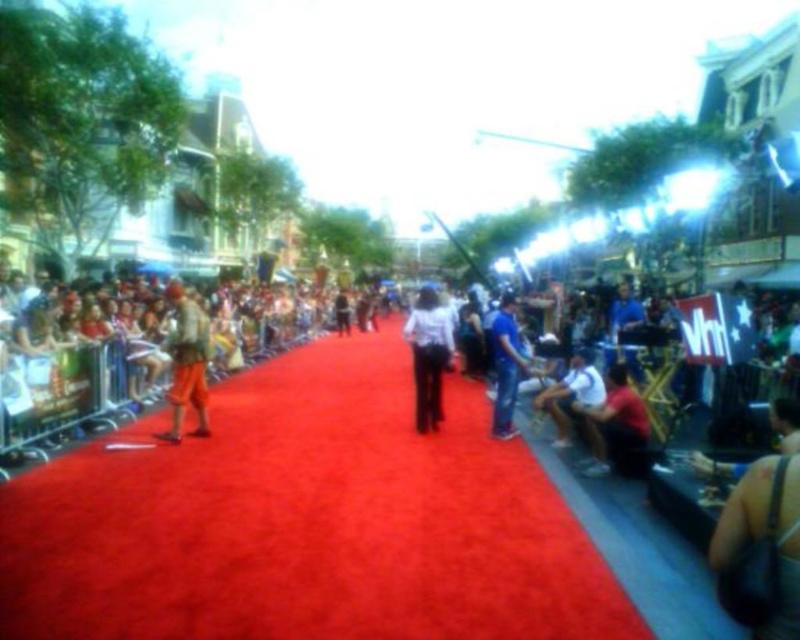
Question: Can you confirm if matte white shirt at lower right is positioned to the right of white cotton shirt at center?

Choices:
 (A) yes
 (B) no

Answer: (A)

Question: Which point is farther from the camera taking this photo?

Choices:
 (A) (566, 378)
 (B) (176, 289)
 (C) (624, 417)

Answer: (A)

Question: Which point is closer to the camera taking this photo?

Choices:
 (A) (582, 364)
 (B) (172, 300)

Answer: (A)

Question: Is orange cotton pants at left positioned at the back of white cotton shirt at center?

Choices:
 (A) yes
 (B) no

Answer: (A)

Question: Which object is closer to the camera taking this photo?

Choices:
 (A) white cotton shirt at center
 (B) blue denim jeans at center
 (C) matte white shirt at lower right

Answer: (C)

Question: Can you confirm if matte white shirt at lower right is wider than orange cotton pants at left?

Choices:
 (A) no
 (B) yes

Answer: (B)